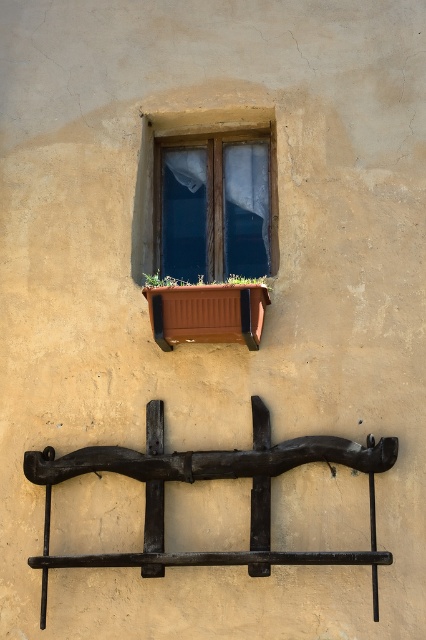
Question: In this image, where is wooden window at upper center located relative to green leafy plant at center?

Choices:
 (A) below
 (B) above

Answer: (B)

Question: In this image, where is wooden window at upper center located relative to brown wooden planter at center?

Choices:
 (A) above
 (B) below

Answer: (A)

Question: Is wooden window at upper center behind green leafy plant at center?

Choices:
 (A) yes
 (B) no

Answer: (A)

Question: Which of the following is the closest to the observer?

Choices:
 (A) black metal rail at center
 (B) brown wooden planter at center
 (C) green leafy plant at center

Answer: (A)

Question: Which point is farther to the camera?

Choices:
 (A) green leafy plant at center
 (B) brown wooden planter at center

Answer: (A)

Question: Among these objects, which one is farthest from the camera?

Choices:
 (A) black metal rail at center
 (B) green leafy plant at center

Answer: (B)